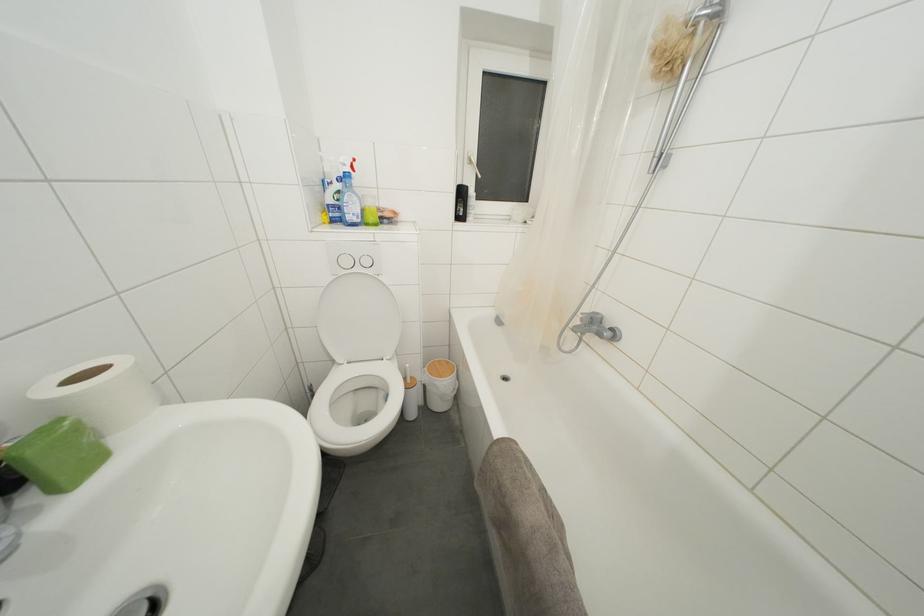
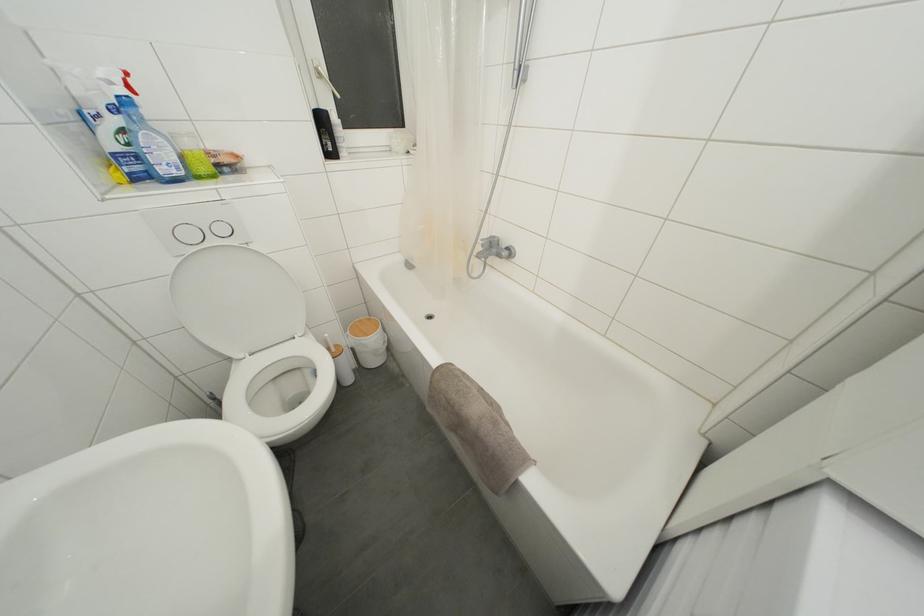
The point at [411,370] is marked in the first image. Where is the corresponding point in the second image?

(331, 339)